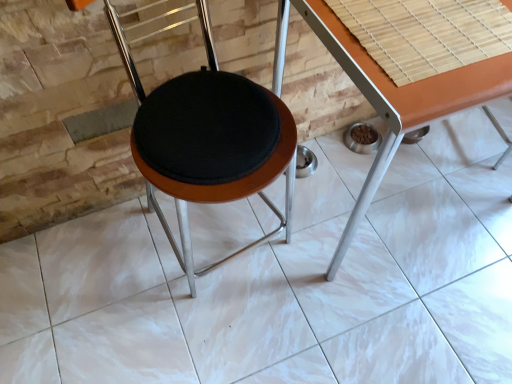
Locate an element on the screen. This screenshot has height=384, width=512. vacant space underneath bamboo mat at upper right (from a real-world perspective) is located at coordinates (420, 22).